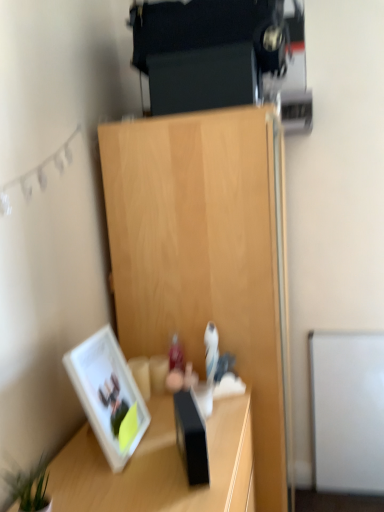
You are a GUI agent. You are given a task and a screenshot of the screen. Output one action in this format:
    pyautogui.click(x=<x>, y=<y>)
    Task: Click on the vacant space in front of white glossy picture frame at lower left
    This screenshot has width=384, height=512.
    Given the screenshot: What is the action you would take?
    pyautogui.click(x=111, y=485)